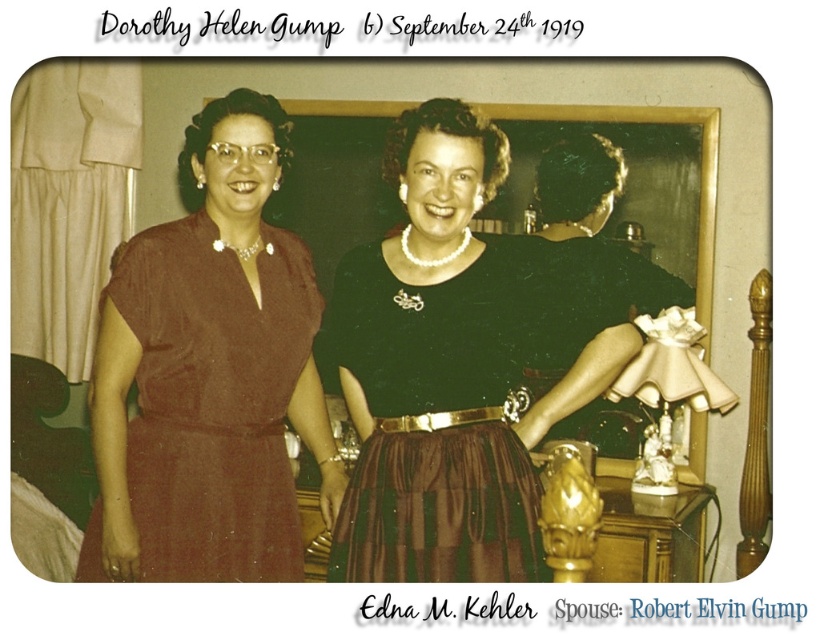
Does black satin dress at center appear on the left side of brown satin dress at left?

No, black satin dress at center is not to the left of brown satin dress at left.

Can you confirm if black satin dress at center is positioned above brown satin dress at left?

Yes.

Identify the location of black satin dress at center. Image resolution: width=820 pixels, height=640 pixels. (467, 360).